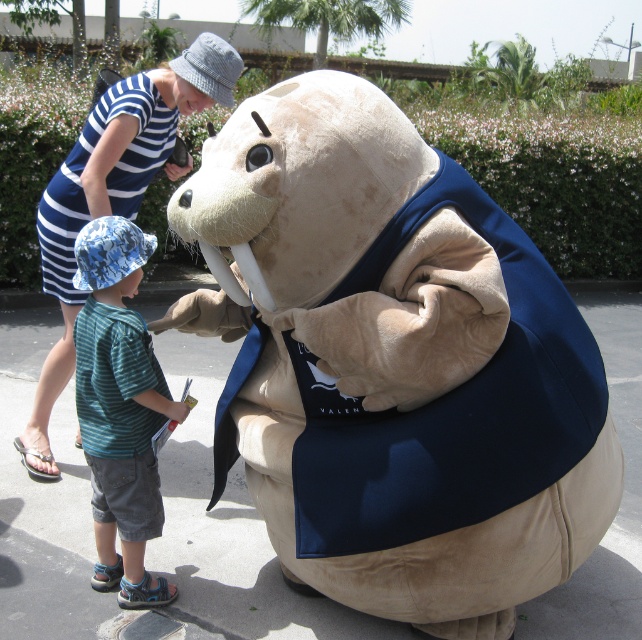
Is striped cotton dress at upper left below blue striped dress at upper left?

Indeed, striped cotton dress at upper left is positioned under blue striped dress at upper left.

Is striped cotton dress at upper left in front of blue striped dress at upper left?

Yes, it is.

Is point (76, 298) positioned before point (160, 109)?

No, (76, 298) is behind (160, 109).

Find the location of `striped cotton dress at upper left`. striped cotton dress at upper left is located at coordinates (114, 193).

Can you confirm if fuzzy beige plush at center is taller than striped cotton shirt at center?

Yes.

What are the coordinates of `fuzzy beige plush at center` in the screenshot? It's located at (394, 364).

Where is `fuzzy beige plush at center`? The width and height of the screenshot is (642, 640). fuzzy beige plush at center is located at coordinates (394, 364).

Can you confirm if fuzzy beige plush at center is shorter than striped cotton dress at upper left?

Indeed, fuzzy beige plush at center has a lesser height compared to striped cotton dress at upper left.

Is point (469, 563) positioned after point (114, 196)?

No, (469, 563) is closer to viewer.

Does point (340, 358) come closer to viewer compared to point (119, 97)?

Yes, it is.

Locate an element on the screen. This screenshot has height=640, width=642. fuzzy beige plush at center is located at coordinates (394, 364).